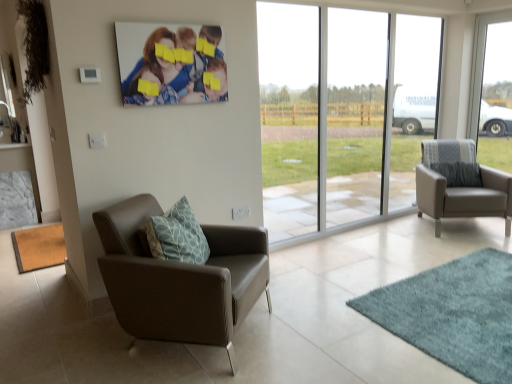
Find the location of `free spot above matte canvas print at upper center (from a real-world perspective)`. free spot above matte canvas print at upper center (from a real-world perspective) is located at coordinates (175, 23).